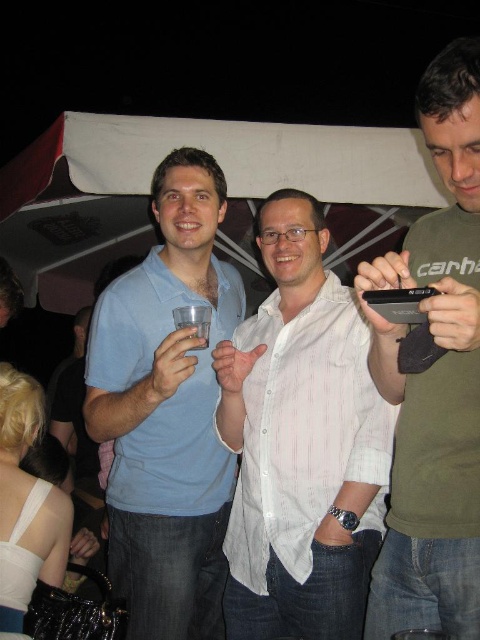
You are standing at the entrance of the tent and see two points marked in the image. One is at coordinate point (207,369) and the other at point (443,387). Which point is closer to you?

Point (207,369) is closer to you because it is further to the viewer than point (443,387).

You are organizing a photo shoot and need to arrange the two people wearing the white striped shirt at center and the green matte shirt at center. Based on their sizes, which one should you place in a position that requires a larger space?

The white striped shirt at center is larger in size than the green matte shirt at center, so you should place the white striped shirt at center in the position that requires more space.